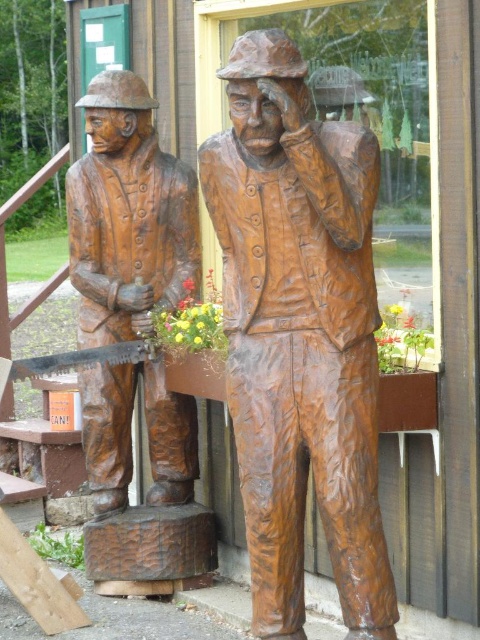
Question: Is bronze wood carving at center positioned in front of matte brown saw at left?

Choices:
 (A) no
 (B) yes

Answer: (B)

Question: Is bronze wood carving at center wider than matte brown saw at left?

Choices:
 (A) no
 (B) yes

Answer: (B)

Question: Which point is closer to the camera?

Choices:
 (A) bronze wood carving at center
 (B) matte brown saw at left

Answer: (A)

Question: Can you confirm if bronze wood carving at center is positioned below matte brown saw at left?

Choices:
 (A) no
 (B) yes

Answer: (B)

Question: Among these points, which one is farthest from the camera?

Choices:
 (A) coord(95,324)
 (B) coord(372,630)

Answer: (A)